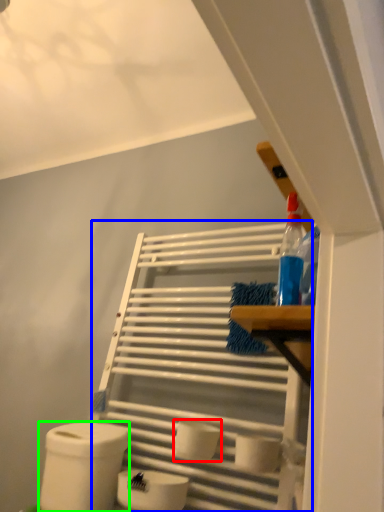
Question: Estimate the real-world distances between objects in this image. Which object is farther from toilet paper (highlighted by a red box), shelf (highlighted by a blue box) or toilet paper (highlighted by a green box)?

Choices:
 (A) shelf
 (B) toilet paper

Answer: (A)